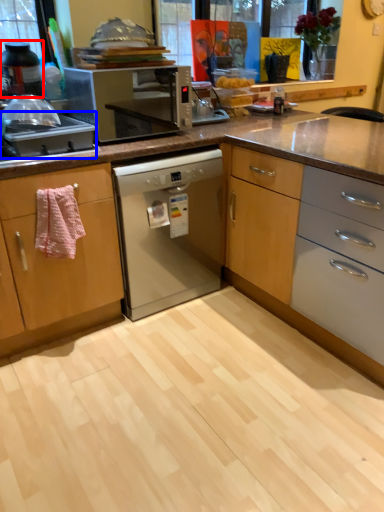
Question: Which of the following is the closest to the observer, kitchen appliance (highlighted by a red box) or kitchen appliance (highlighted by a blue box)?

Choices:
 (A) kitchen appliance
 (B) kitchen appliance

Answer: (B)